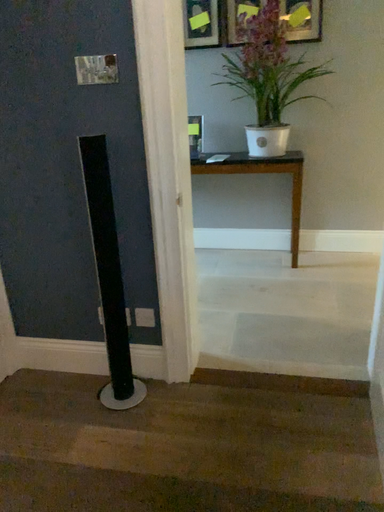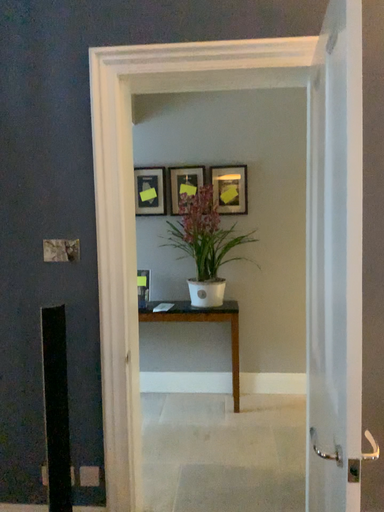
Question: Which way did the camera rotate in the video?

Choices:
 (A) rotated left
 (B) rotated right

Answer: (B)